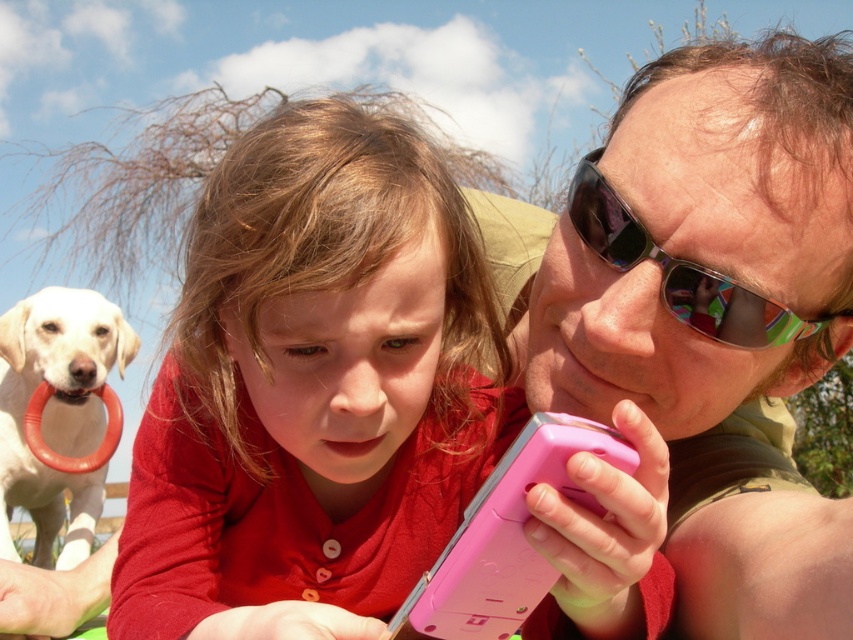
Question: Is matte pink phone at center to the left of pink matte phone at center from the viewer's perspective?

Choices:
 (A) no
 (B) yes

Answer: (B)

Question: Which object is positioned farthest from the black reflective sunglasses at upper right?

Choices:
 (A) white matte dog at left
 (B) matte pink phone at center
 (C) pink matte phone at center
 (D) pink plastic smartphone at center

Answer: (A)

Question: Which of the following is the closest to the observer?

Choices:
 (A) pink matte phone at center
 (B) matte pink phone at center

Answer: (A)

Question: Can you confirm if pink matte phone at center is positioned below black reflective sunglasses at upper right?

Choices:
 (A) yes
 (B) no

Answer: (A)

Question: Which point is farther to the camera?

Choices:
 (A) (3, 449)
 (B) (602, 180)
 (C) (450, 592)

Answer: (A)

Question: Is matte pink phone at center bigger than pink matte phone at center?

Choices:
 (A) yes
 (B) no

Answer: (B)